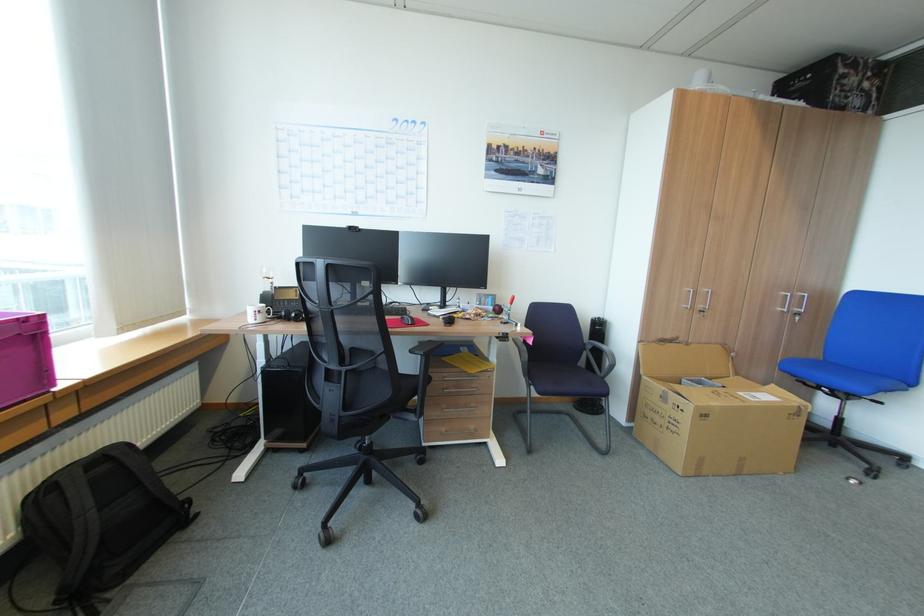
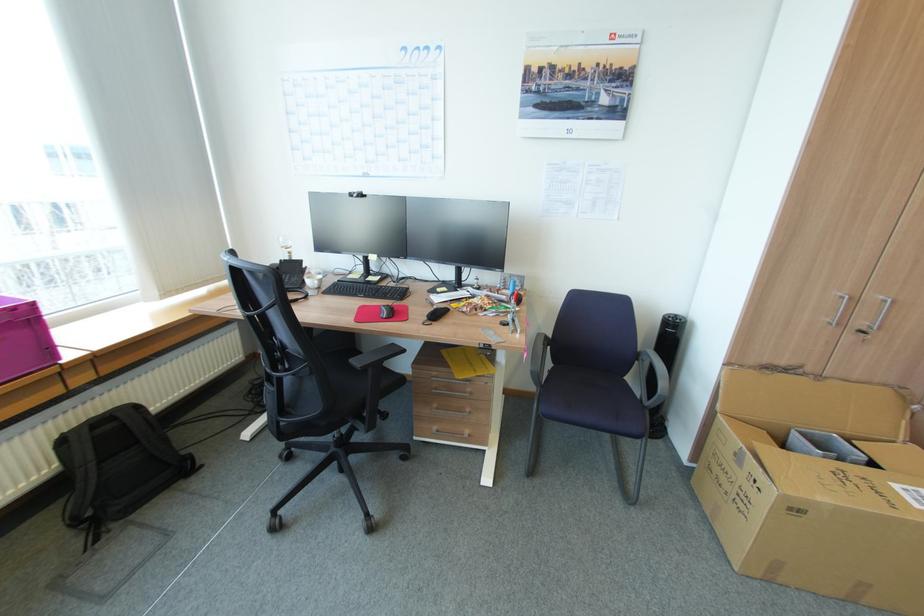
Where in the second image is the point corresponding to the point at 711,416 from the first image?

(804, 511)